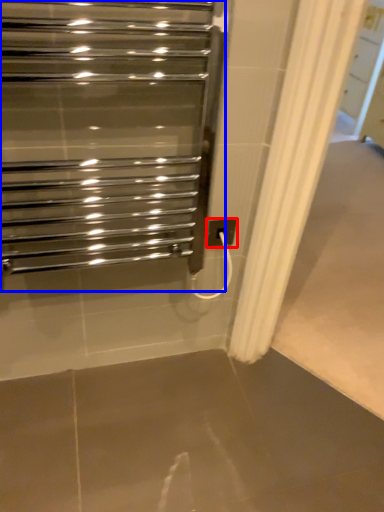
Question: Which of the following is the farthest to the observer, electric outlet (highlighted by a red box) or home appliance (highlighted by a blue box)?

Choices:
 (A) electric outlet
 (B) home appliance

Answer: (A)